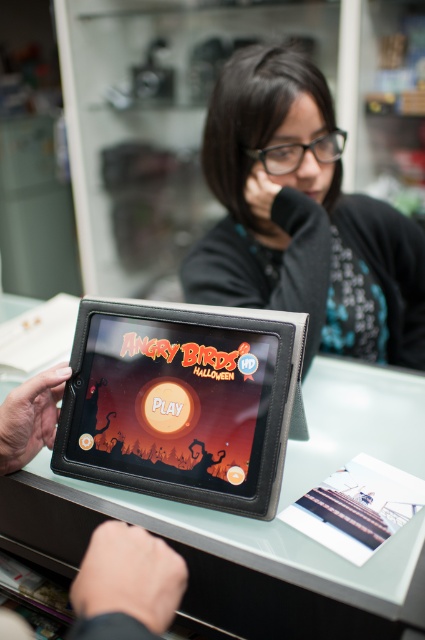
You are trying to decide whether to place a new phone charger on the table next to the black matte jacket at upper center and the black leather tablet at center. Based on their positions, where should you place it so it doesn

The black matte jacket at upper center is located above the black leather tablet at center, so placing the charger between them would ensure it is accessible near both items.

You are trying to decide whether to place the black leather tablet at center into the black matte jacket at upper center. Based on their sizes, will the tablet fit inside the jacket?

The black matte jacket at upper center is wider than the black leather tablet at center, so the tablet should fit inside the jacket as long as the jacket has a compartment designed to hold the tablet.

You are trying to reach the black leather tablet at center while holding the black matte jacket at upper center. Can you safely move your hand between them without touching either?

The distance between the black matte jacket at upper center and the black leather tablet at center is 17.95 inches, so yes, you can safely move your hand between them without touching either object.